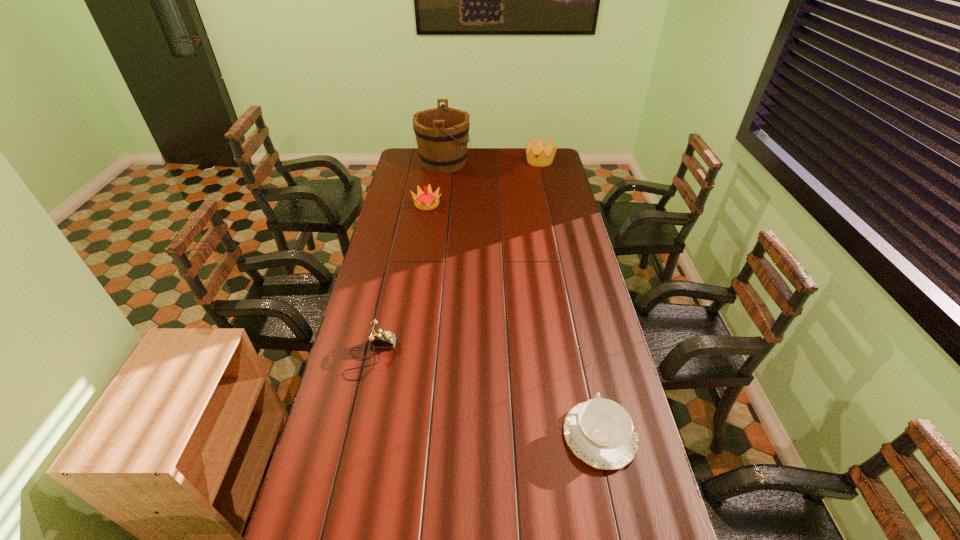
This screenshot has height=540, width=960. I want to click on object positioned at the far left corner, so click(x=441, y=133).

Identify the location of object at the far right corner. (546, 153).

In the image, there is a desktop. Where is `vacant space at the left edge`? This screenshot has height=540, width=960. vacant space at the left edge is located at coordinates tap(364, 309).

The image size is (960, 540). Find the location of `free space at the right edge of the desktop`. free space at the right edge of the desktop is located at coordinates (596, 323).

You are a GUI agent. You are given a task and a screenshot of the screen. Output one action in this format:
    pyautogui.click(x=<x>, y=<y>)
    Task: Click on the blank space at the far left corner
    
    Given the screenshot: What is the action you would take?
    pyautogui.click(x=408, y=154)

The image size is (960, 540). Find the location of `free area in between the nearest object and the left crown`. free area in between the nearest object and the left crown is located at coordinates 514,320.

Where is `free space between the wine bucket and the right crown`? This screenshot has height=540, width=960. free space between the wine bucket and the right crown is located at coordinates (492, 161).

Where is `free point between the chinaware and the fourth farthest object`? The height and width of the screenshot is (540, 960). free point between the chinaware and the fourth farthest object is located at coordinates (486, 396).

I want to click on free space between the telephone and the wine bucket, so click(407, 259).

You are a GUI agent. You are given a task and a screenshot of the screen. Output one action in this format:
    pyautogui.click(x=<x>, y=<y>)
    Task: Click on the empty space that is in between the farther crown and the third farthest object
    The width and height of the screenshot is (960, 540).
    Given the screenshot: What is the action you would take?
    pyautogui.click(x=484, y=183)